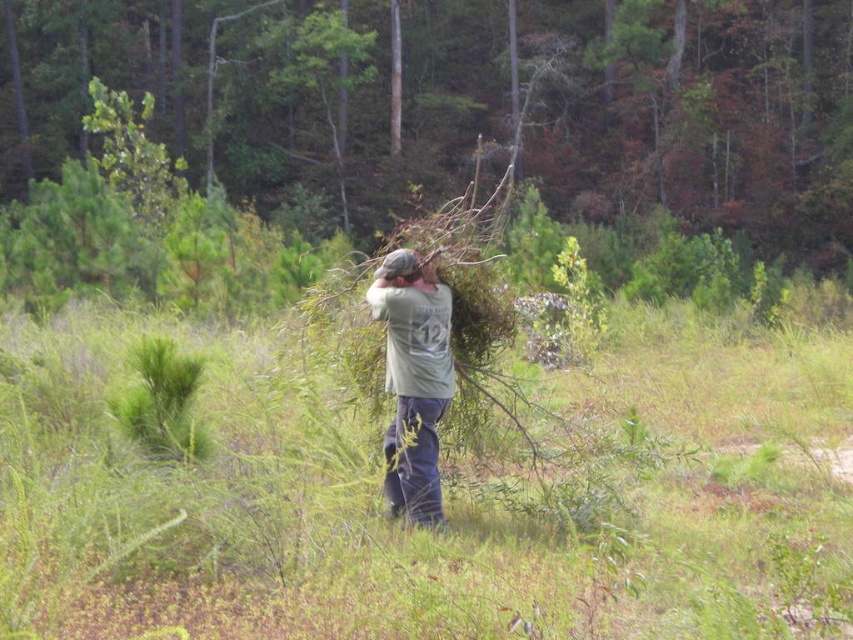
Based on the scene description, which object is taller between the green grass at center and the gray matte hair at center?

The green grass at center is taller than the gray matte hair at center.